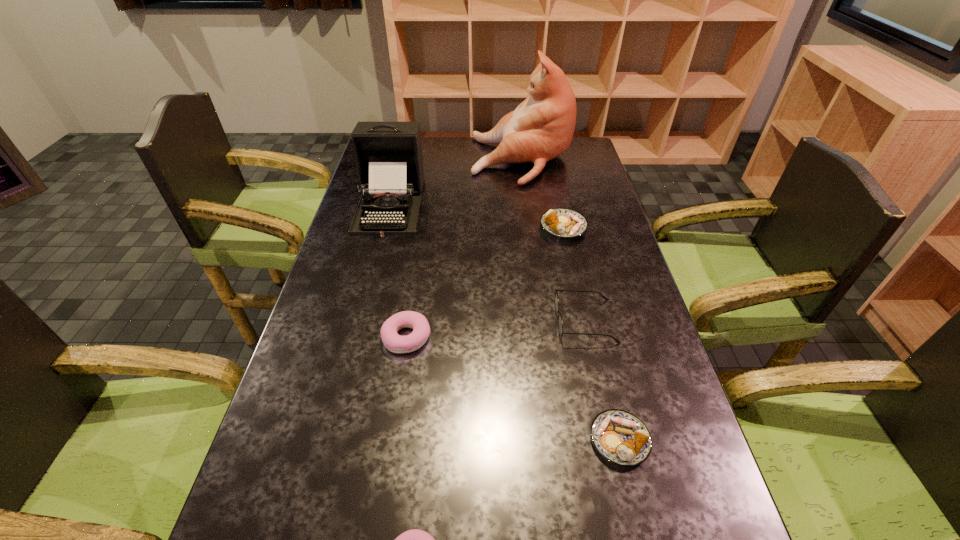
Select which object appears as the third closest to the nearest object. Please provide its 2D coordinates. Your answer should be formatted as a tuple, i.e. [(x, y)], where the tuple contains the x and y coordinates of a point satisfying the conditions above.

[(560, 323)]

You are a GUI agent. You are given a task and a screenshot of the screen. Output one action in this format:
    pyautogui.click(x=<x>, y=<y>)
    Task: Click on the object that ranks as the third closest to the spectacles
    The height and width of the screenshot is (540, 960).
    Given the screenshot: What is the action you would take?
    pyautogui.click(x=395, y=343)

In order to click on the fourth closest pastry to the typewriter in this screenshot , I will do `click(415, 539)`.

The image size is (960, 540). I want to click on pastry that can be found as the third closest to the spectacles, so click(395, 343).

This screenshot has width=960, height=540. In order to click on the closest brown pastry to the nearest object in this screenshot , I will do `click(620, 437)`.

Locate an element on the screen. free region that satisfies the following two spatial constraints: 1. on the face of the cat; 2. on the back side of the farthest pastry is located at coordinates (530, 227).

Locate an element on the screen. The height and width of the screenshot is (540, 960). free space in the image that satisfies the following two spatial constraints: 1. on the face of the sixth farthest object; 2. on the right side of the cat is located at coordinates (559, 440).

At what (x,y) coordinates should I click in order to perform the action: click on free spot that satisfies the following two spatial constraints: 1. on the front side of the smaller brown pastry; 2. on the right side of the farthest pastry. Please return your answer as a coordinate pair (x, y). The image size is (960, 540). Looking at the image, I should click on (611, 440).

Locate an element on the screen. free spot that satisfies the following two spatial constraints: 1. on the back side of the nearer brown pastry; 2. on the front-facing side of the spectacles is located at coordinates (591, 321).

What are the coordinates of `free space that satisfies the following two spatial constraints: 1. on the front side of the smaller brown pastry; 2. on the right side of the bigger pink pastry` in the screenshot? It's located at (392, 440).